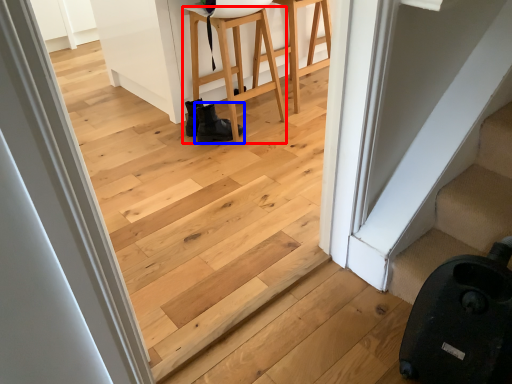
Question: Which of the following is the closest to the observer, furniture (highlighted by a red box) or footwear (highlighted by a blue box)?

Choices:
 (A) furniture
 (B) footwear

Answer: (A)